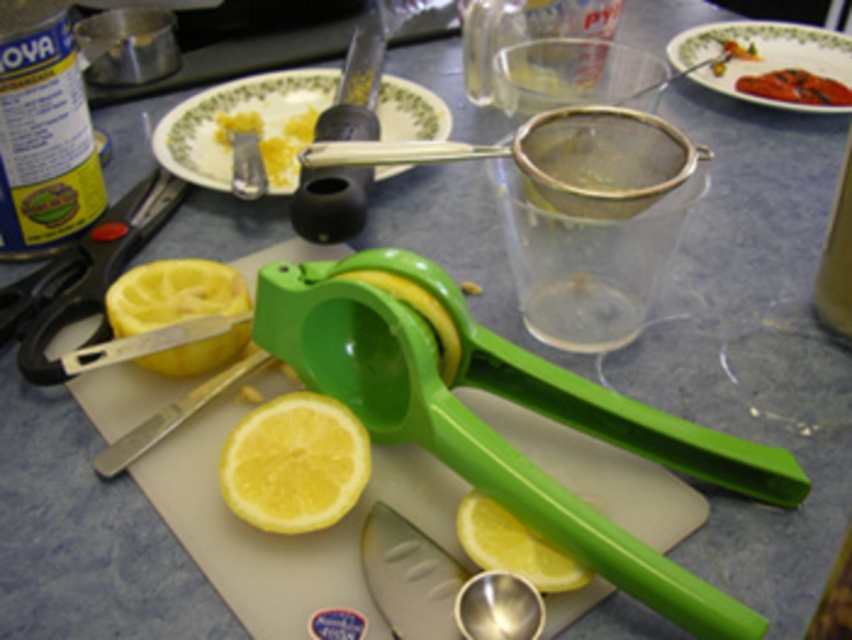
Is yellow matte lemon at center to the left of yellow matte lemon at center-left from the viewer's perspective?

No, yellow matte lemon at center is not to the left of yellow matte lemon at center-left.

Does yellow matte lemon at center have a smaller size compared to yellow matte lemon at center-left?

Yes, yellow matte lemon at center is smaller than yellow matte lemon at center-left.

Identify the location of yellow matte lemon at center. (294, 464).

Identify the location of yellow matte lemon at center. [294, 464].

Does green matte juicer at center appear on the left side of grilled meat at upper right?

Indeed, green matte juicer at center is positioned on the left side of grilled meat at upper right.

Does green matte juicer at center appear under grilled meat at upper right?

Yes.

The height and width of the screenshot is (640, 852). I want to click on green matte juicer at center, so click(419, 314).

Can you confirm if yellow matte lemon at center-left is thinner than yellow matte lemon at lower center?

No, yellow matte lemon at center-left is not thinner than yellow matte lemon at lower center.

Based on the photo, is yellow matte lemon at center-left shorter than yellow matte lemon at lower center?

Incorrect, yellow matte lemon at center-left's height does not fall short of yellow matte lemon at lower center's.

Which is in front, point (167, 275) or point (540, 561)?

Point (540, 561) is more forward.

Locate an element on the screen. This screenshot has width=852, height=640. yellow matte lemon at center-left is located at coordinates (173, 294).